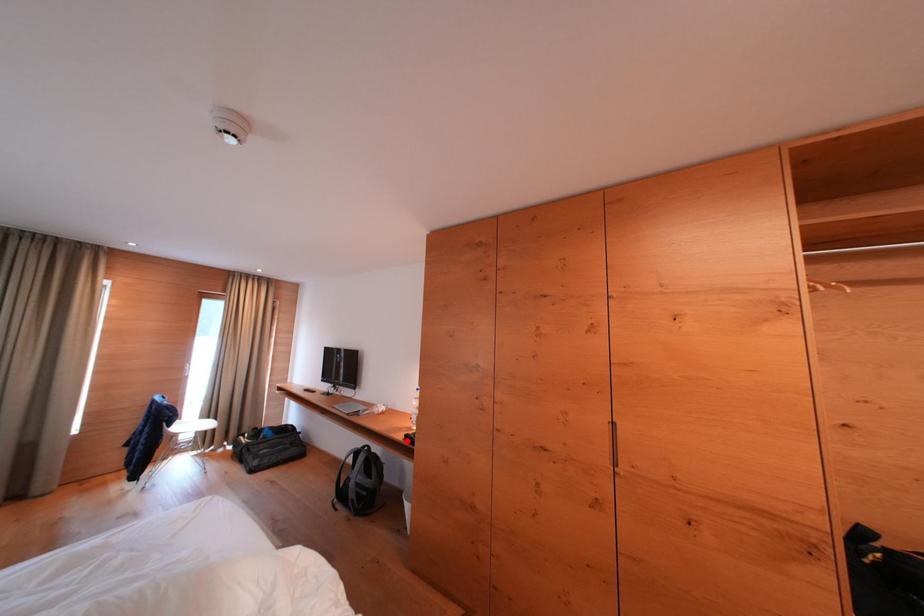
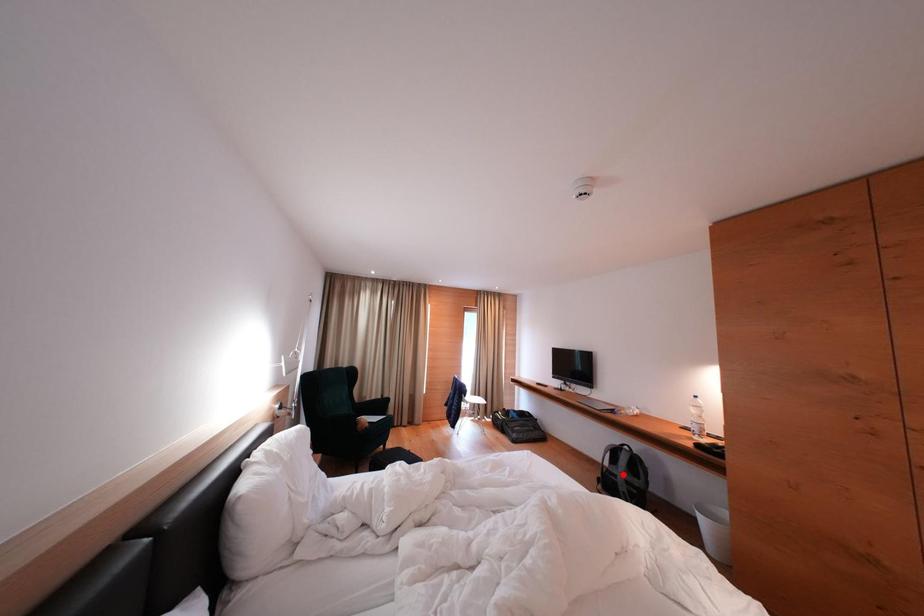
I am providing you with two images of the same scene from different viewpoints. A red point is marked on the first image and another point is marked on the second image. Is the red point in image1 aligned with the point shown in image2?

No